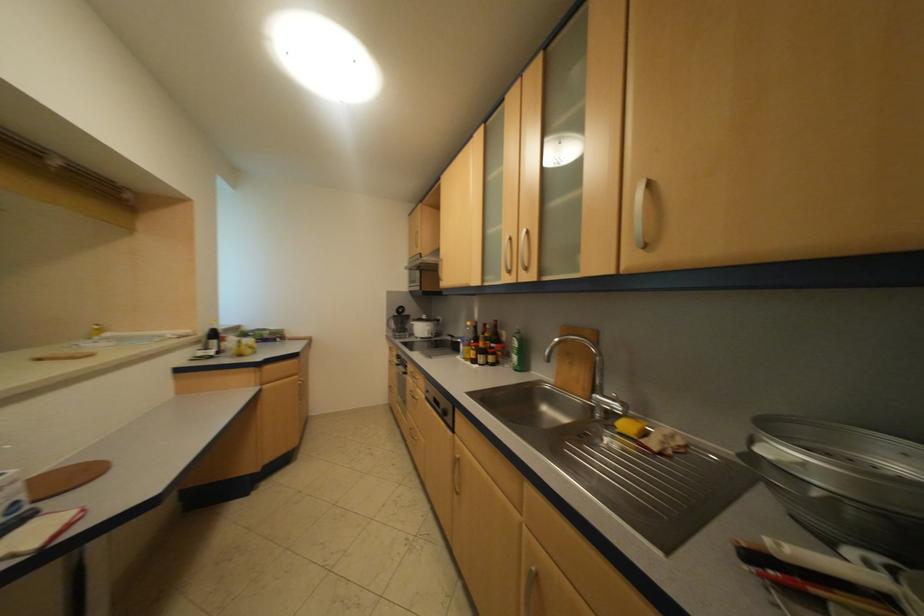
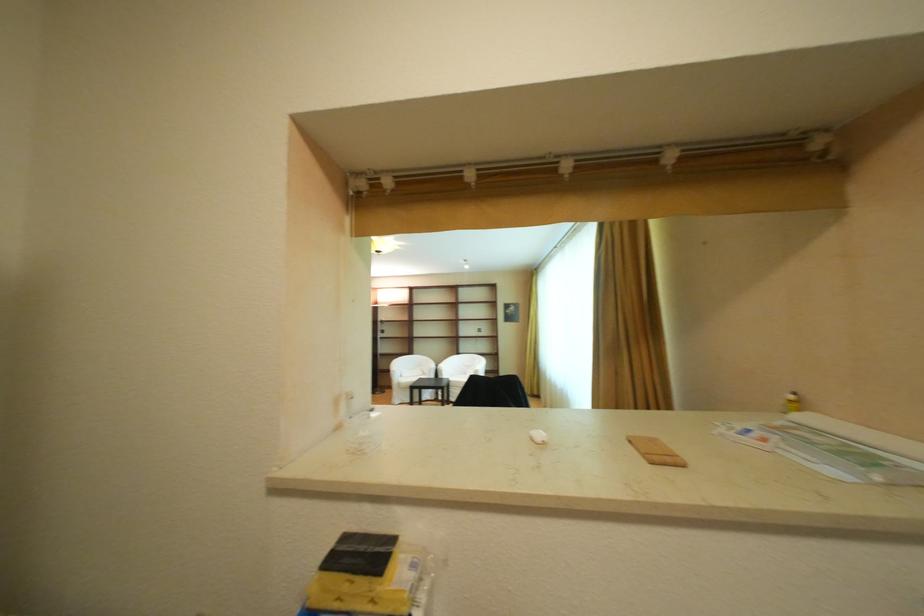
In the second image, find the point that corresponds to [52,361] in the first image.

(642, 444)